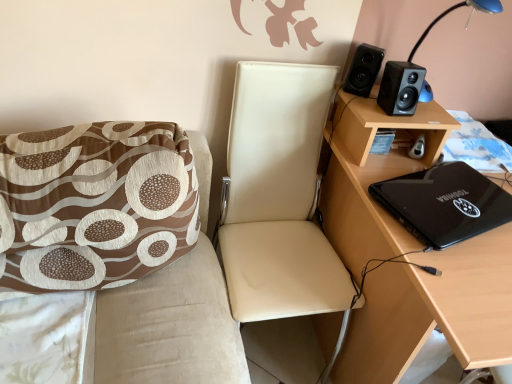
Question: Is black matte speaker at upper right, the 1th speaker in the left-to-right sequence, at the back of brown printed fabric cushion at left, acting as the first chair starting from the left?

Choices:
 (A) yes
 (B) no

Answer: (B)

Question: Can you confirm if brown printed fabric cushion at left, acting as the first chair starting from the left, is bigger than black matte speaker at upper right, the second speaker positioned from the right?

Choices:
 (A) no
 (B) yes

Answer: (B)

Question: Does brown printed fabric cushion at left, acting as the first chair starting from the left, have a smaller size compared to black matte speaker at upper right, the 1th speaker in the left-to-right sequence?

Choices:
 (A) no
 (B) yes

Answer: (A)

Question: From the image's perspective, is brown printed fabric cushion at left, acting as the first chair starting from the left, located beneath black matte speaker at upper right, the second speaker positioned from the right?

Choices:
 (A) yes
 (B) no

Answer: (A)

Question: Does brown printed fabric cushion at left, the 2th chair from the right, appear on the left side of black matte speaker at upper right, the 1th speaker in the left-to-right sequence?

Choices:
 (A) yes
 (B) no

Answer: (A)

Question: Is black matte speaker at upper right, arranged as the 1th speaker when viewed from the right, wider or thinner than black plastic table lamp at upper right?

Choices:
 (A) wide
 (B) thin

Answer: (B)

Question: Is point (398, 102) positioned closer to the camera than point (451, 11)?

Choices:
 (A) closer
 (B) farther

Answer: (A)

Question: From a real-world perspective, is black matte speaker at upper right, the 2th speaker viewed from the left, above or below black plastic table lamp at upper right?

Choices:
 (A) above
 (B) below

Answer: (B)

Question: Considering the positions of black matte speaker at upper right, the 2th speaker viewed from the left, and black plastic table lamp at upper right in the image, is black matte speaker at upper right, the 2th speaker viewed from the left, bigger or smaller than black plastic table lamp at upper right?

Choices:
 (A) big
 (B) small

Answer: (B)

Question: Is point (403, 109) positioned closer to the camera than point (223, 289)?

Choices:
 (A) farther
 (B) closer

Answer: (B)

Question: Based on their sizes in the image, would you say black matte speaker at upper right, the 2th speaker viewed from the left, is bigger or smaller than brown printed fabric cushion at left, the 2th chair from the right?

Choices:
 (A) small
 (B) big

Answer: (A)

Question: From a real-world perspective, is black matte speaker at upper right, arranged as the 1th speaker when viewed from the right, above or below brown printed fabric cushion at left, the 2th chair from the right?

Choices:
 (A) above
 (B) below

Answer: (A)

Question: Considering the relative positions of black matte speaker at upper right, arranged as the 1th speaker when viewed from the right, and brown printed fabric cushion at left, the 2th chair from the right, in the image provided, is black matte speaker at upper right, arranged as the 1th speaker when viewed from the right, to the left or to the right of brown printed fabric cushion at left, the 2th chair from the right,?

Choices:
 (A) right
 (B) left

Answer: (A)

Question: From the image's perspective, is black plastic table lamp at upper right above or below leather-like beige chair at center, the 1th chair from the right?

Choices:
 (A) above
 (B) below

Answer: (A)

Question: From a real-world perspective, is black plastic table lamp at upper right above or below leather-like beige chair at center, the 2th chair positioned from the left?

Choices:
 (A) above
 (B) below

Answer: (A)